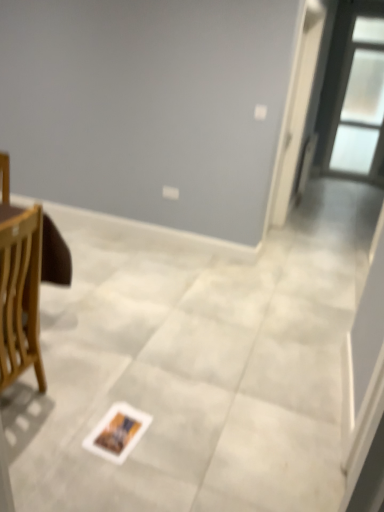
This screenshot has width=384, height=512. I want to click on vacant space underneath white glossy screen door at upper right (from a real-world perspective), so click(x=273, y=231).